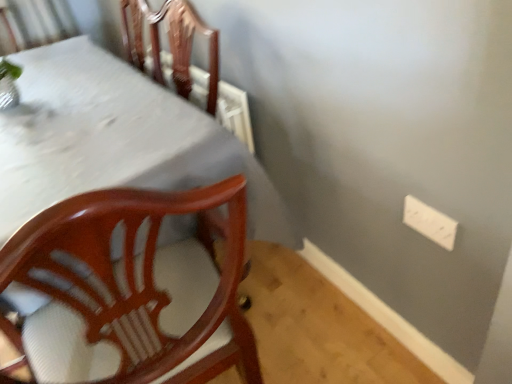
Question: From a real-world perspective, is white plastic electric outlet at upper right physically above white glossy table at upper left?

Choices:
 (A) no
 (B) yes

Answer: (B)

Question: From a real-world perspective, is white plastic electric outlet at upper right positioned under white glossy table at upper left based on gravity?

Choices:
 (A) yes
 (B) no

Answer: (B)

Question: Is white plastic electric outlet at upper right positioned before white glossy table at upper left?

Choices:
 (A) no
 (B) yes

Answer: (A)

Question: Is white plastic electric outlet at upper right aimed at white glossy table at upper left?

Choices:
 (A) yes
 (B) no

Answer: (A)

Question: Can you confirm if white plastic electric outlet at upper right is taller than white glossy table at upper left?

Choices:
 (A) no
 (B) yes

Answer: (A)

Question: Is white plastic electric outlet at upper right shorter than white glossy table at upper left?

Choices:
 (A) no
 (B) yes

Answer: (B)

Question: Is white plastic electric outlet at upper right completely or partially inside white glossy table at upper left?

Choices:
 (A) no
 (B) yes

Answer: (A)

Question: Is white glossy table at upper left closer to camera compared to white plastic electric outlet at upper right?

Choices:
 (A) yes
 (B) no

Answer: (A)

Question: Is white glossy table at upper left oriented towards white plastic electric outlet at upper right?

Choices:
 (A) no
 (B) yes

Answer: (A)

Question: Is white glossy table at upper left next to white plastic electric outlet at upper right and touching it?

Choices:
 (A) no
 (B) yes

Answer: (A)

Question: Is white glossy table at upper left positioned beyond the bounds of white plastic electric outlet at upper right?

Choices:
 (A) yes
 (B) no

Answer: (A)

Question: Does white glossy table at upper left appear on the right side of white plastic electric outlet at upper right?

Choices:
 (A) no
 (B) yes

Answer: (A)

Question: Is white plastic electric outlet at upper right inside or outside of white glossy table at upper left?

Choices:
 (A) outside
 (B) inside

Answer: (A)